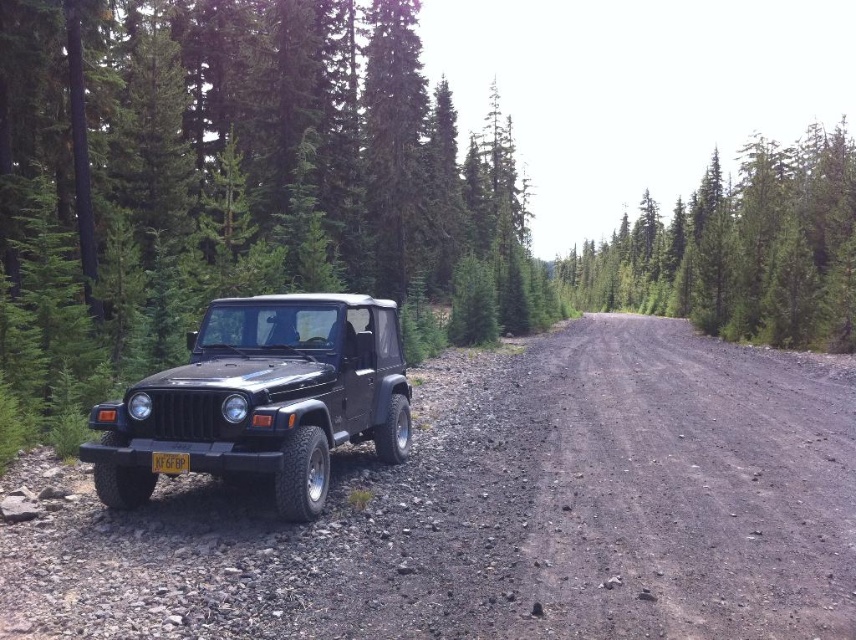
You are a driver approaching the dusty gravel road at center and the yellow matte license plate at center. Which object is located to the right when viewed from the front of the Jeep?

The dusty gravel road at center is positioned on the right side of the yellow matte license plate at center, so when viewed from the front of the Jeep, the dusty gravel road at center is to the right of the yellow matte license plate at center.

You are standing at the point labeled point (x=343, y=355) and want to walk to the point labeled point (x=783, y=612). Which direction should you face to walk towards your destination?

You should face towards the direction away from the camera because point (x=783, y=612) is closer to the camera than point (x=343, y=355).